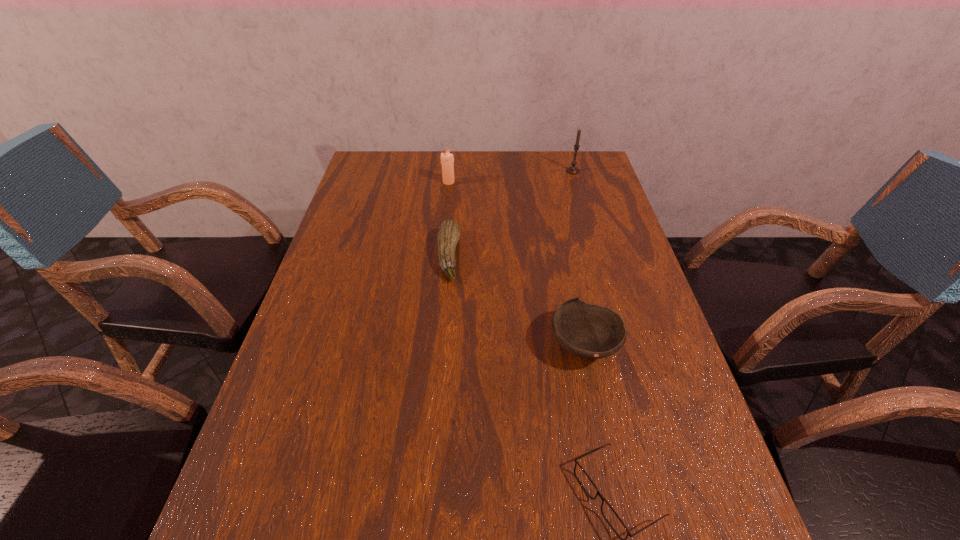
At what (x,y) coordinates should I click in order to perform the action: click on vacant region between the nearer candle and the farthest object. Please return your answer as a coordinate pair (x, y). This screenshot has height=540, width=960. Looking at the image, I should click on (511, 177).

Where is `vacant space that is in between the third tallest object and the third nearest object`? This screenshot has height=540, width=960. vacant space that is in between the third tallest object and the third nearest object is located at coordinates (516, 301).

Identify the location of unoccupied position between the third farthest object and the right candle. pos(511,214).

Identify the location of blank region between the bowl and the zucchini. (516, 301).

The height and width of the screenshot is (540, 960). Identify the location of free space between the shorter candle and the second shortest object. (448, 219).

This screenshot has width=960, height=540. In order to click on free point between the fourth farthest object and the farthest object in this screenshot , I will do `click(579, 258)`.

Where is `vacant space that's between the third nearest object and the third shortest object`? This screenshot has height=540, width=960. vacant space that's between the third nearest object and the third shortest object is located at coordinates (516, 301).

Find the location of `object that is the third closest to the shortest object`. object that is the third closest to the shortest object is located at coordinates (447, 160).

At what (x,y) coordinates should I click in order to perform the action: click on object that stands as the third closest to the third shortest object. Please return your answer as a coordinate pair (x, y). The width and height of the screenshot is (960, 540). Looking at the image, I should click on (447, 160).

The width and height of the screenshot is (960, 540). What are the coordinates of `free spot that satisfies the following two spatial constraints: 1. at the stem end of the fourth tallest object; 2. on the right side of the fourth farthest object` in the screenshot? It's located at (442, 345).